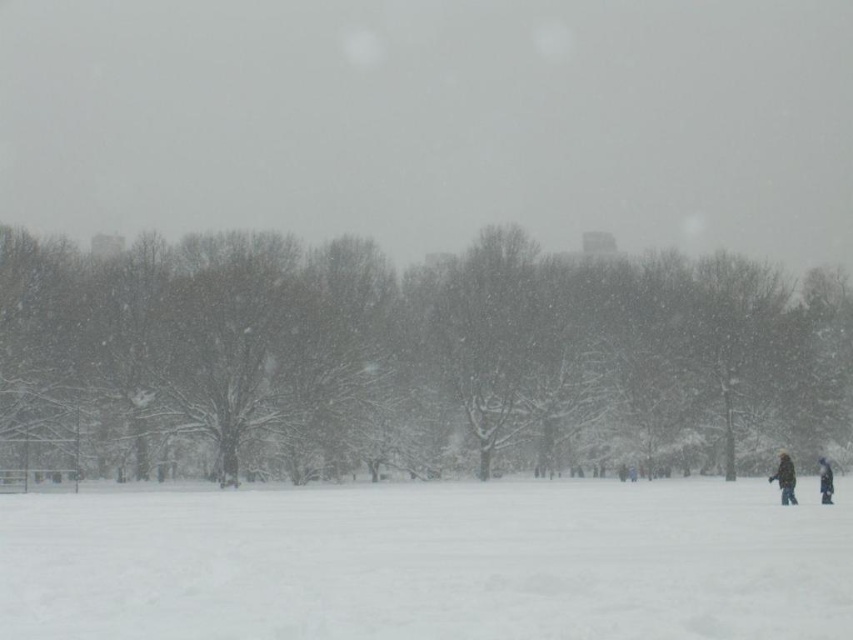
You are standing in the snowy landscape and want to move from the point at coordinates point (309, 541) to the point at coordinates point (772, 476). Which direction should you face to walk towards the second point?

You should face towards the upper direction because point (772, 476) is located higher up in the image compared to point (309, 541).

You are a hiker trying to find your way back to the trailhead. You see the white fluffy snow at lower center and the brown fuzzy coat at lower right. Which object is closer to you?

The brown fuzzy coat at lower right is closer to you because the white fluffy snow at lower center is positioned over it, indicating it is further away.